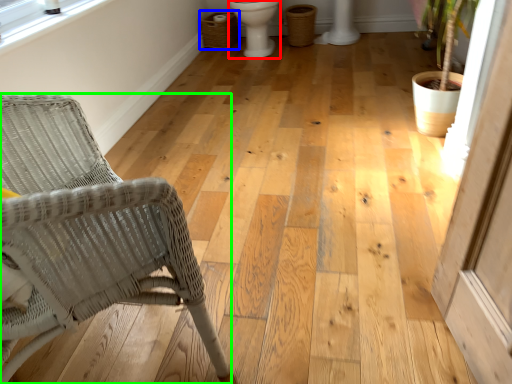
Question: Considering the real-world distances, which object is farthest from toilet bowl (highlighted by a red box)? laundry basket (highlighted by a blue box) or chair (highlighted by a green box)?

Choices:
 (A) laundry basket
 (B) chair

Answer: (B)